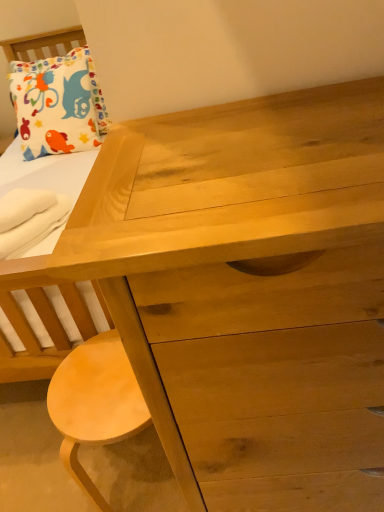
Question: Relative to light brown wood stool at lower left, is white cotton pillow at upper left in front or behind?

Choices:
 (A) front
 (B) behind

Answer: (B)

Question: Is white cotton pillow at upper left spatially inside light brown wood stool at lower left, or outside of it?

Choices:
 (A) inside
 (B) outside

Answer: (B)

Question: Which is farther from the white cotton pillow at upper left?

Choices:
 (A) light brown wood stool at lower left
 (B) white soft towel at lower left

Answer: (A)

Question: Considering the real-world distances, which object is closest to the light brown wood stool at lower left?

Choices:
 (A) white cotton pillow at upper left
 (B) white soft towel at lower left

Answer: (B)